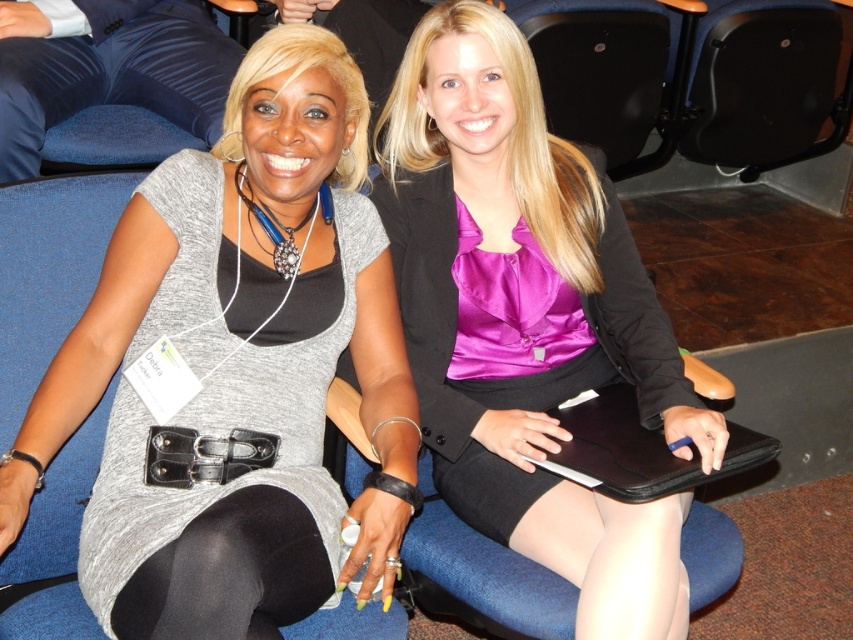
Question: Which point is closer to the camera?

Choices:
 (A) purple satin blouse at center
 (B) matte gray dress at center

Answer: (B)

Question: Which point is closer to the camera taking this photo?

Choices:
 (A) (471, 332)
 (B) (206, 506)

Answer: (B)

Question: From the image, what is the correct spatial relationship of matte gray dress at center in relation to purple satin blouse at center?

Choices:
 (A) left
 (B) right

Answer: (A)

Question: Is matte gray dress at center closer to camera compared to purple satin blouse at center?

Choices:
 (A) yes
 (B) no

Answer: (A)

Question: Is matte gray dress at center below purple satin blouse at center?

Choices:
 (A) yes
 (B) no

Answer: (B)